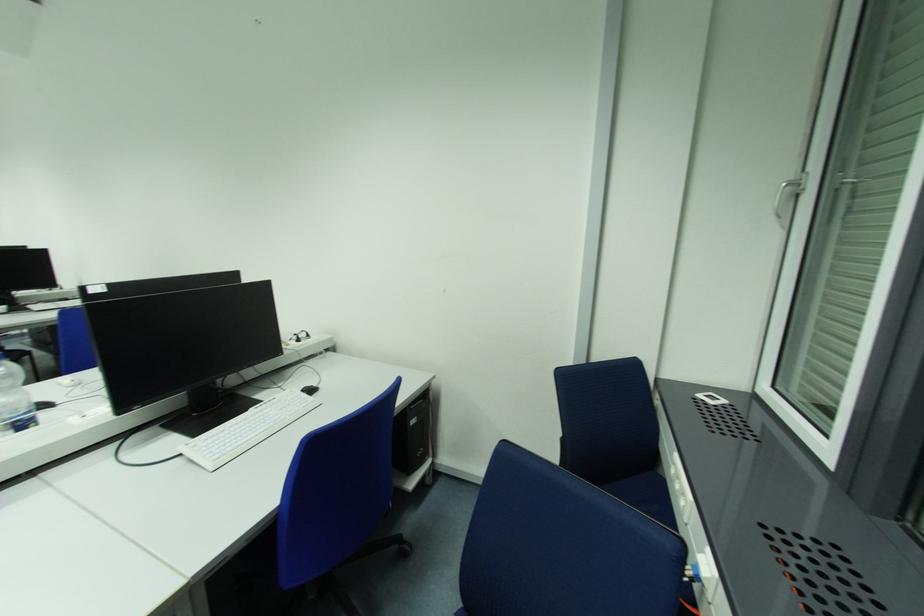
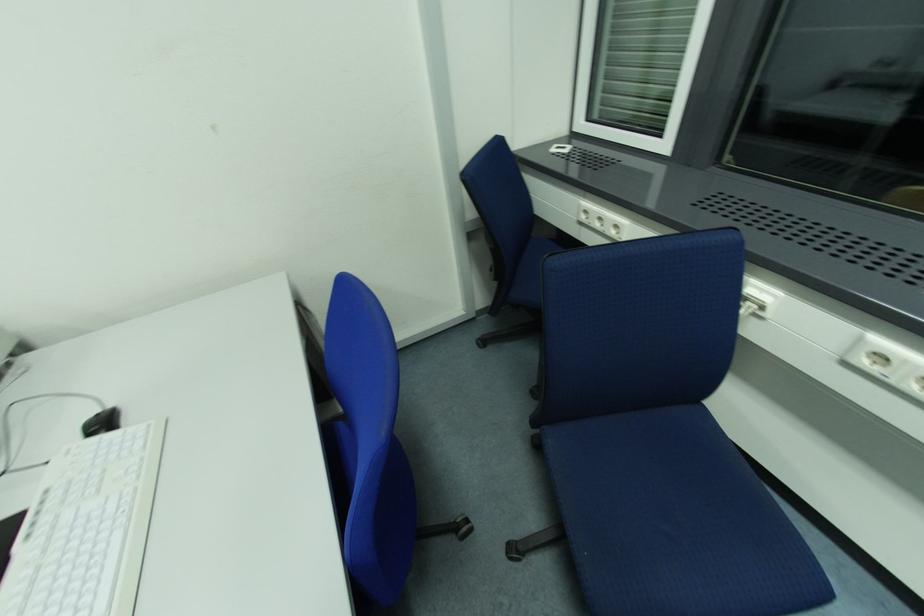
The first image is from the beginning of the video and the second image is from the end. How did the camera likely rotate when shooting the video?

The camera's rotation is toward right-down.